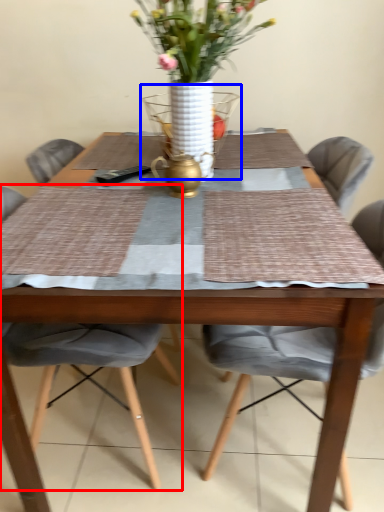
Question: Among these objects, which one is farthest to the camera, chair (highlighted by a red box) or glass vase (highlighted by a blue box)?

Choices:
 (A) chair
 (B) glass vase

Answer: (B)